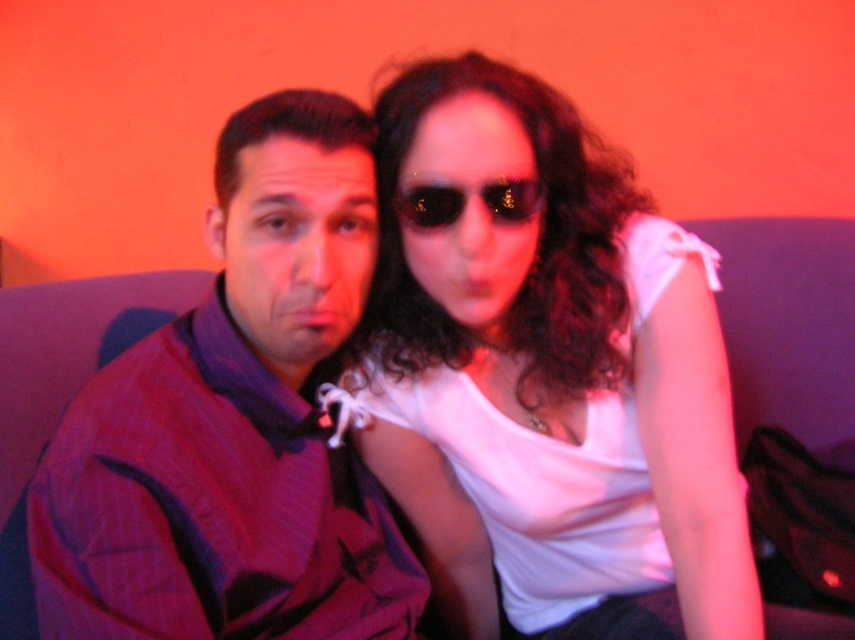
Between white matte tank top at center and black reflective sunglasses at center, which one is positioned lower?

white matte tank top at center

Is white matte tank top at center shorter than black reflective sunglasses at center?

In fact, white matte tank top at center may be taller than black reflective sunglasses at center.

Locate an element on the screen. The width and height of the screenshot is (855, 640). white matte tank top at center is located at coordinates (551, 378).

Can you confirm if white matte tank top at center is shorter than purple striped shirt at left?

In fact, white matte tank top at center may be taller than purple striped shirt at left.

Who is more distant from viewer, [669,538] or [293,387]?

The point [293,387] is behind.

This screenshot has width=855, height=640. What are the coordinates of `white matte tank top at center` in the screenshot? It's located at (551, 378).

Which of these two, purple striped shirt at left or black reflective sunglasses at center, stands shorter?

Standing shorter between the two is black reflective sunglasses at center.

Does purple striped shirt at left have a smaller size compared to black reflective sunglasses at center?

Incorrect, purple striped shirt at left is not smaller in size than black reflective sunglasses at center.

Measure the distance between point (96, 401) and camera.

Point (96, 401) is 28.47 inches away from camera.

The image size is (855, 640). Identify the location of purple striped shirt at left. pyautogui.click(x=234, y=424).